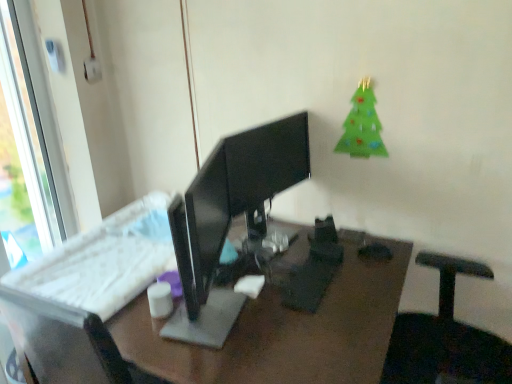
Question: Looking at their shapes, would you say black glossy monitor at center is wider or thinner than white plastic window at left?

Choices:
 (A) wide
 (B) thin

Answer: (A)

Question: From a real-world perspective, relative to white plastic window at left, is black glossy monitor at center vertically above or below?

Choices:
 (A) above
 (B) below

Answer: (B)

Question: Based on their relative distances, which object is nearer to the white matte cup at center?

Choices:
 (A) black glossy monitor at center
 (B) green felt christmas tree at upper right
 (C) white plastic keyboard at center
 (D) white plastic window at left

Answer: (C)

Question: Estimate the real-world distances between objects in this image. Which object is closer to the green felt christmas tree at upper right?

Choices:
 (A) white plastic window at left
 (B) black glossy monitor at center
 (C) white plastic keyboard at center
 (D) white matte cup at center

Answer: (B)